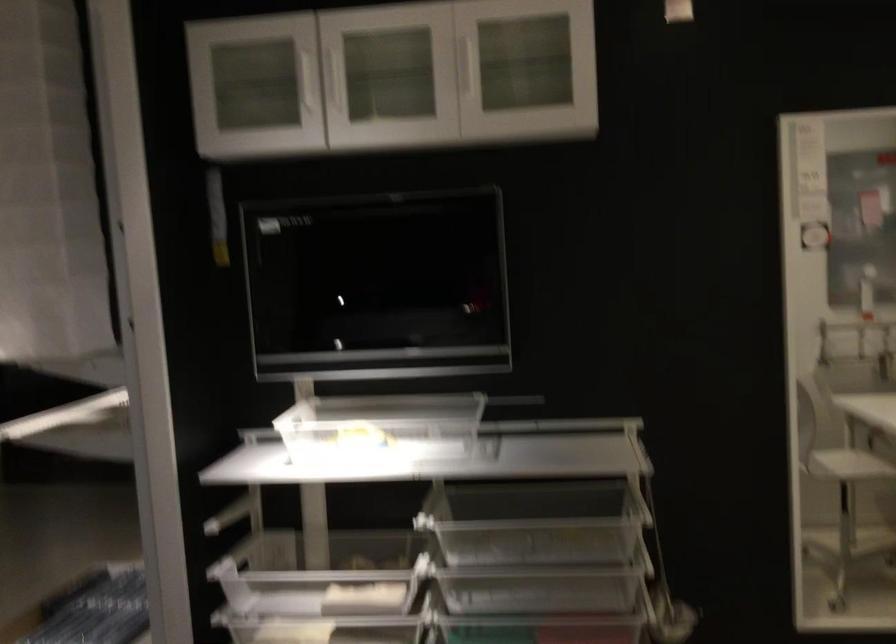
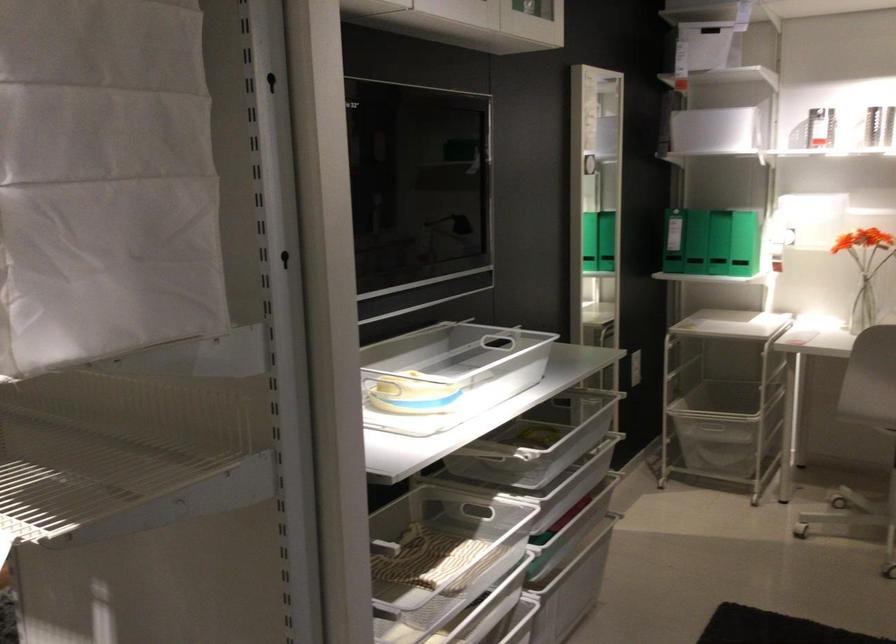
In the second image, find the point that corresponds to point 640,560 in the first image.

(561, 428)